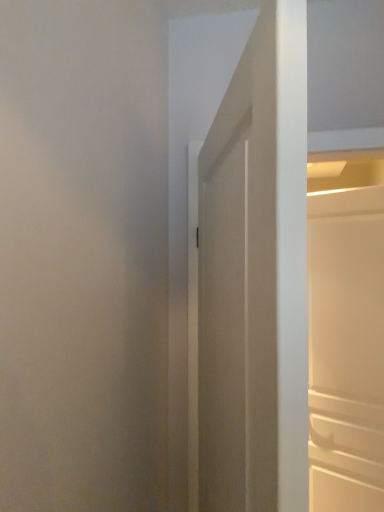
Question: Is white matte door at center, which is the 1th door in front-to-back order, to the left of white matte cabinet at right, which is the first door from back to front, from the viewer's perspective?

Choices:
 (A) yes
 (B) no

Answer: (A)

Question: Can we say white matte door at center, placed as the first door when sorted from left to right, lies outside white matte cabinet at right, the first door from the right?

Choices:
 (A) no
 (B) yes

Answer: (B)

Question: Is white matte door at center, placed as the first door when sorted from left to right, positioned before white matte cabinet at right, which is the second door from front to back?

Choices:
 (A) yes
 (B) no

Answer: (A)

Question: From the image's perspective, does white matte door at center, which ranks as the second door in right-to-left order, appear higher than white matte cabinet at right, the first door from the right?

Choices:
 (A) yes
 (B) no

Answer: (A)

Question: Are white matte door at center, placed as the first door when sorted from left to right, and white matte cabinet at right, which is the first door from back to front, beside each other?

Choices:
 (A) yes
 (B) no

Answer: (B)

Question: Considering the relative sizes of white matte door at center, which is the 2th door in back-to-front order, and white matte cabinet at right, the first door from the right, in the image provided, is white matte door at center, which is the 2th door in back-to-front order, bigger than white matte cabinet at right, the first door from the right,?

Choices:
 (A) no
 (B) yes

Answer: (B)

Question: Is white matte cabinet at right, which is the second door from front to back, shorter than white matte door at center, which ranks as the second door in right-to-left order?

Choices:
 (A) yes
 (B) no

Answer: (B)

Question: Considering the relative positions of white matte cabinet at right, the first door from the right, and white matte door at center, which ranks as the second door in right-to-left order, in the image provided, is white matte cabinet at right, the first door from the right, to the right of white matte door at center, which ranks as the second door in right-to-left order, from the viewer's perspective?

Choices:
 (A) yes
 (B) no

Answer: (A)

Question: From the image's perspective, is white matte cabinet at right, the second door viewed from the left, located above white matte door at center, which is the 1th door in front-to-back order?

Choices:
 (A) yes
 (B) no

Answer: (B)

Question: Is white matte cabinet at right, the second door viewed from the left, outside white matte door at center, which is the 2th door in back-to-front order?

Choices:
 (A) no
 (B) yes

Answer: (B)

Question: Considering the relative positions of white matte cabinet at right, the first door from the right, and white matte door at center, which ranks as the second door in right-to-left order, in the image provided, is white matte cabinet at right, the first door from the right, to the left of white matte door at center, which ranks as the second door in right-to-left order, from the viewer's perspective?

Choices:
 (A) yes
 (B) no

Answer: (B)

Question: Are white matte cabinet at right, the second door viewed from the left, and white matte door at center, placed as the first door when sorted from left to right, located far from each other?

Choices:
 (A) yes
 (B) no

Answer: (A)

Question: Considering the positions of white matte cabinet at right, which is the second door from front to back, and white matte door at center, placed as the first door when sorted from left to right, in the image, is white matte cabinet at right, which is the second door from front to back, bigger or smaller than white matte door at center, placed as the first door when sorted from left to right,?

Choices:
 (A) big
 (B) small

Answer: (B)